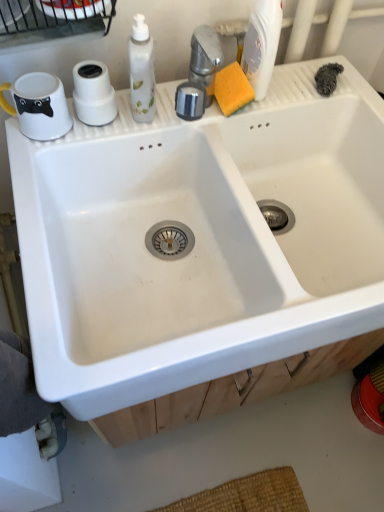
The image size is (384, 512). I want to click on free spot to the right of white plastic bottle at upper right, so click(x=311, y=89).